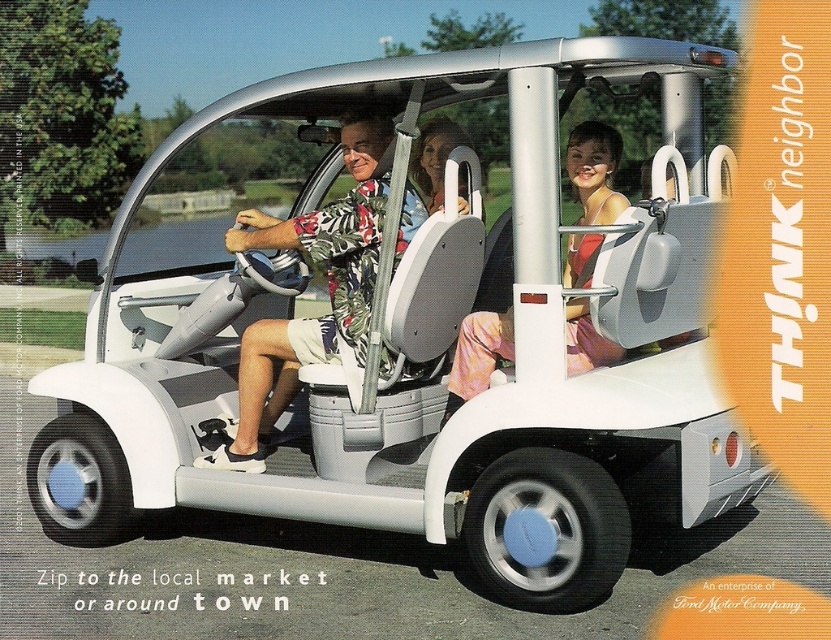
Is point (347, 221) in front of point (588, 300)?

No.

Identify the location of floral fabric shirt at center. The image size is (831, 640). (327, 285).